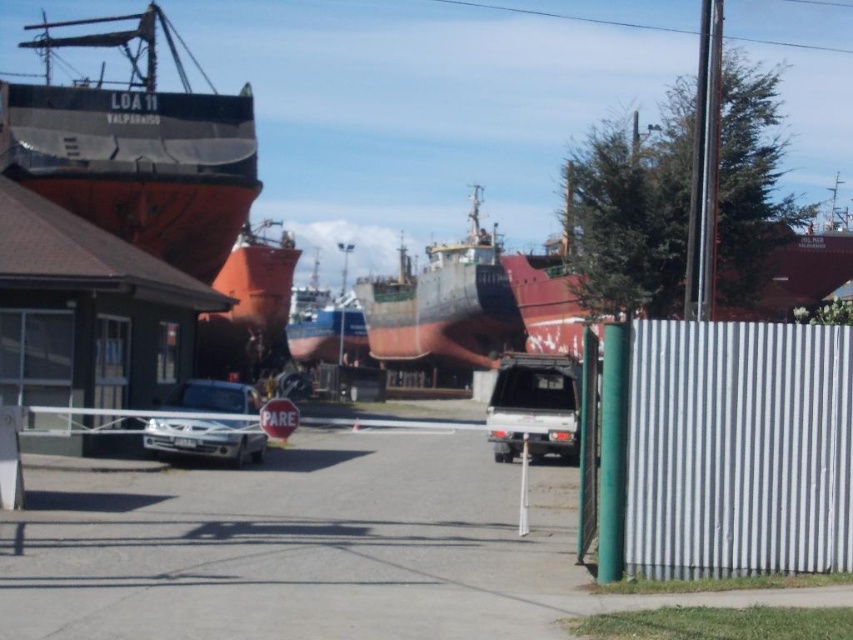
You are a delivery driver approaching the shipyard and see the silver corrugated fence at right and the rusty metal ship at center. Which object is taller?

The rusty metal ship at center is taller than the silver corrugated fence at right.

You are a delivery driver approaching the shipyard. You need to determine if your truck, which is the same height as the satin silver truck at center, can pass under the rusty metal boat at center without hitting it. Can your truck safely pass underneath?

The rusty metal boat at center has a greater height compared to the satin silver truck at center. Since the truck is the same height as the satin silver truck at center, it can safely pass underneath the rusty metal boat at center as the boat is taller and there should be sufficient clearance.